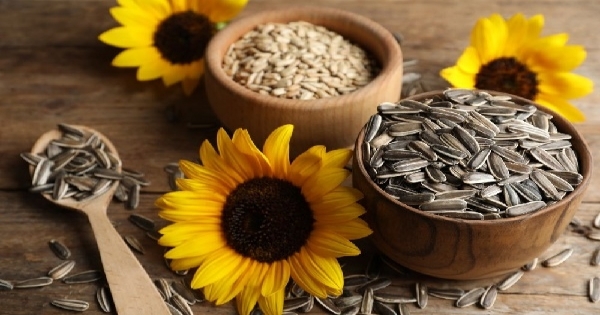
You are a GUI agent. You are given a task and a screenshot of the screen. Output one action in this format:
    pyautogui.click(x=<x>, y=<y>)
    Task: Click on the brown bowl
    Image resolution: width=600 pixels, height=315 pixels.
    Given the screenshot: What is the action you would take?
    pyautogui.click(x=491, y=257)